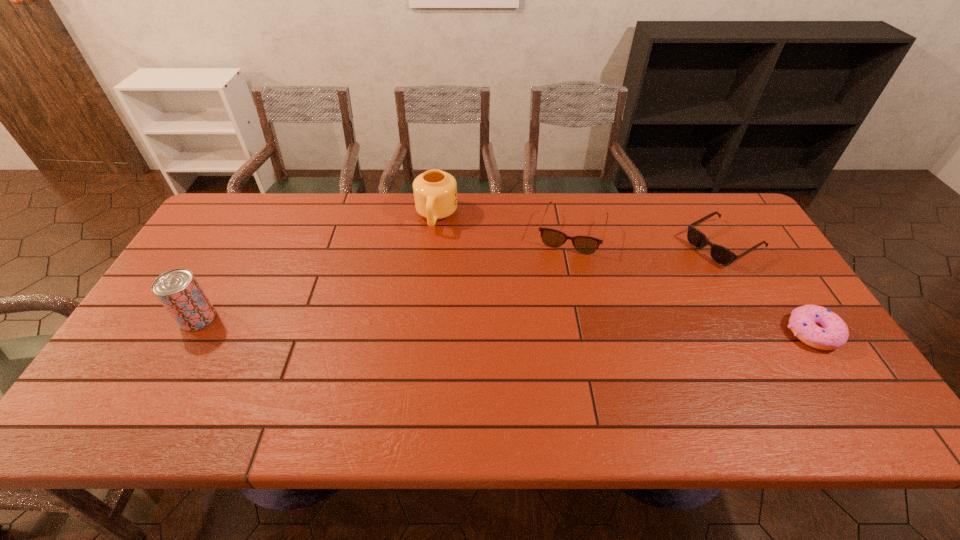
Identify the location of free space on the desktop that is between the beer can and the doughnut and is positioned at the front view of the third object from right to left. (545, 326).

Where is `free space on the desktop that is between the beer can and the doughnut and is positioned at the front lenses of the sunglasses`? The height and width of the screenshot is (540, 960). free space on the desktop that is between the beer can and the doughnut and is positioned at the front lenses of the sunglasses is located at coordinates (574, 327).

Where is `free spot on the desktop that is between the beer can and the doughnut and is positioned on the handle side of the second object from left to right`? The width and height of the screenshot is (960, 540). free spot on the desktop that is between the beer can and the doughnut and is positioned on the handle side of the second object from left to right is located at coordinates (412, 323).